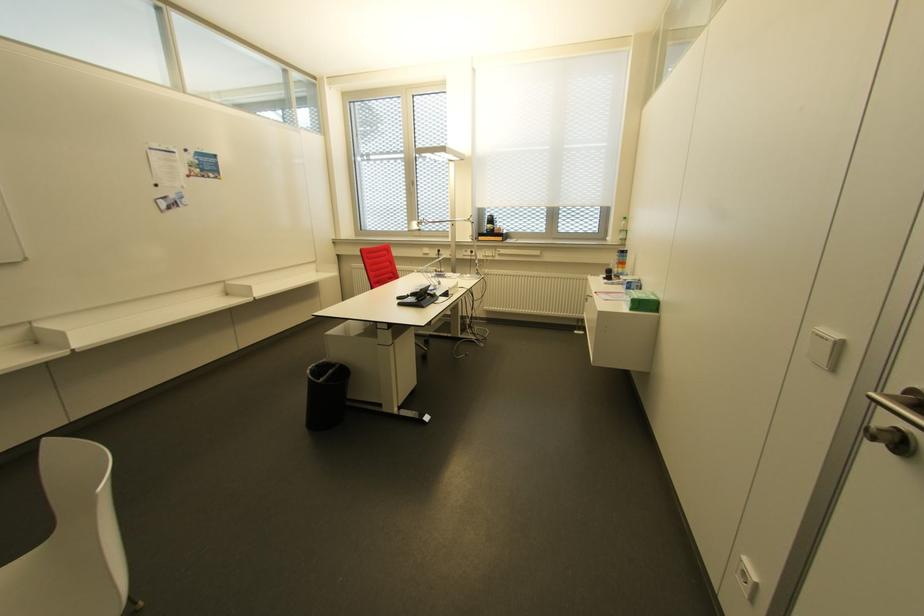
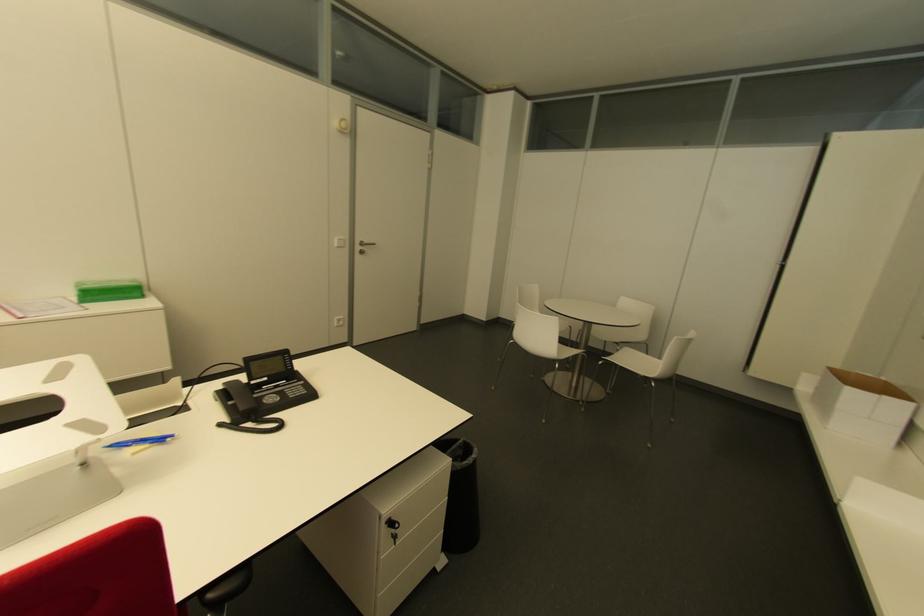
In the second image, find the point that corresponds to the point at 837,345 in the first image.

(343, 240)